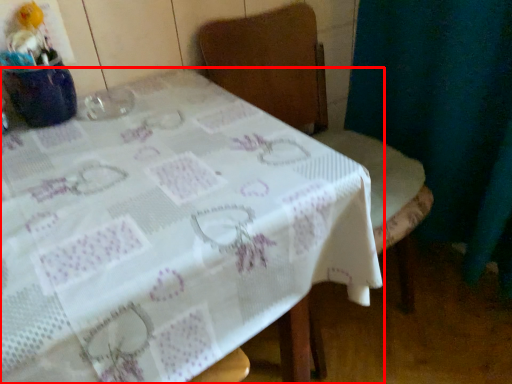
Question: From the image's perspective, where is table (annotated by the red box) located in relation to chair in the image?

Choices:
 (A) above
 (B) below

Answer: (B)